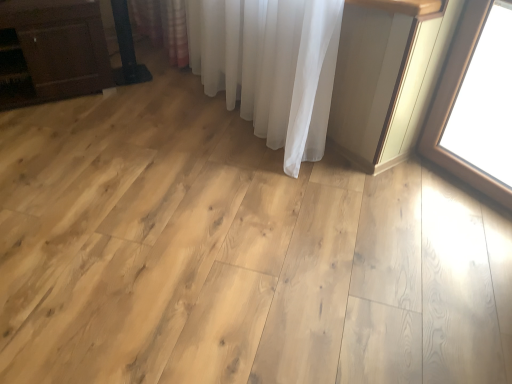
What do you see at coordinates (51, 51) in the screenshot?
I see `matte brown cabinet at left` at bounding box center [51, 51].

Locate an element on the screen. matte brown cabinet at left is located at coordinates (51, 51).

Measure the distance between point (49, 78) and camera.

Point (49, 78) and camera are 2.58 meters apart from each other.

What is the approximate width of matte brown cabinet at left?

matte brown cabinet at left is 22.74 inches wide.

The height and width of the screenshot is (384, 512). Describe the element at coordinates (271, 66) in the screenshot. I see `white sheer curtain at center` at that location.

Find the location of a particular element. This screenshot has width=512, height=384. white sheer curtain at center is located at coordinates (271, 66).

Locate an element on the screen. This screenshot has width=512, height=384. matte brown cabinet at left is located at coordinates (51, 51).

Visually, is matte brown cabinet at left positioned to the left or to the right of white sheer curtain at center?

In the image, matte brown cabinet at left appears on the left side of white sheer curtain at center.

Which is behind, matte brown cabinet at left or white sheer curtain at center?

Positioned behind is matte brown cabinet at left.

Is point (14, 66) less distant than point (316, 147)?

No, it is not.

From the image's perspective, is matte brown cabinet at left beneath white sheer curtain at center?

Indeed, from the image's perspective, matte brown cabinet at left is shown beneath white sheer curtain at center.

From a real-world perspective, is matte brown cabinet at left below white sheer curtain at center?

Yes, from a real-world perspective, matte brown cabinet at left is below white sheer curtain at center.

Is matte brown cabinet at left thinner than white sheer curtain at center?

No.

Which of these two, matte brown cabinet at left or white sheer curtain at center, stands taller?

Standing taller between the two is white sheer curtain at center.

Based on their sizes in the image, would you say matte brown cabinet at left is bigger or smaller than white sheer curtain at center?

matte brown cabinet at left is smaller than white sheer curtain at center.

Would you say matte brown cabinet at left is inside or outside white sheer curtain at center?

matte brown cabinet at left is spatially situated outside white sheer curtain at center.

Would you say matte brown cabinet at left is a long distance from white sheer curtain at center?

Yes, matte brown cabinet at left and white sheer curtain at center are quite far apart.

Is matte brown cabinet at left facing towards white sheer curtain at center?

No, matte brown cabinet at left is not oriented towards white sheer curtain at center.

How many degrees apart are the facing directions of matte brown cabinet at left and white sheer curtain at center?

There is a 81.5-degree angle between the facing directions of matte brown cabinet at left and white sheer curtain at center.

Where is `curtain on the right of matte brown cabinet at left`? Image resolution: width=512 pixels, height=384 pixels. curtain on the right of matte brown cabinet at left is located at coordinates (271, 66).

Considering the relative positions of white sheer curtain at center and matte brown cabinet at left in the image provided, is white sheer curtain at center to the left or to the right of matte brown cabinet at left?

white sheer curtain at center is to the right of matte brown cabinet at left.

Looking at this image, which is in front, white sheer curtain at center or matte brown cabinet at left?

white sheer curtain at center.

Is point (325, 126) closer to camera compared to point (96, 10)?

Yes, point (325, 126) is in front of point (96, 10).

From the image's perspective, is white sheer curtain at center above or below matte brown cabinet at left?

Clearly, from the image's perspective, white sheer curtain at center is above matte brown cabinet at left.

From a real-world perspective, which is physically below, white sheer curtain at center or matte brown cabinet at left?

matte brown cabinet at left, from a real-world perspective.

Can you confirm if white sheer curtain at center is thinner than matte brown cabinet at left?

Yes, white sheer curtain at center is thinner than matte brown cabinet at left.

Is white sheer curtain at center shorter than matte brown cabinet at left?

No, white sheer curtain at center is not shorter than matte brown cabinet at left.

Is white sheer curtain at center bigger than matte brown cabinet at left?

Correct, white sheer curtain at center is larger in size than matte brown cabinet at left.

Can we say white sheer curtain at center lies outside matte brown cabinet at left?

That's correct, white sheer curtain at center is outside of matte brown cabinet at left.

Are white sheer curtain at center and matte brown cabinet at left located far from each other?

white sheer curtain at center is far away from matte brown cabinet at left.

Is white sheer curtain at center oriented away from matte brown cabinet at left?

Yes.

Image resolution: width=512 pixels, height=384 pixels. Find the location of `curtain on the right of matte brown cabinet at left`. curtain on the right of matte brown cabinet at left is located at coordinates (271, 66).

The height and width of the screenshot is (384, 512). I want to click on curtain located above the matte brown cabinet at left (from a real-world perspective), so click(x=271, y=66).

In order to click on curtain above the matte brown cabinet at left (from the image's perspective) in this screenshot , I will do `click(271, 66)`.